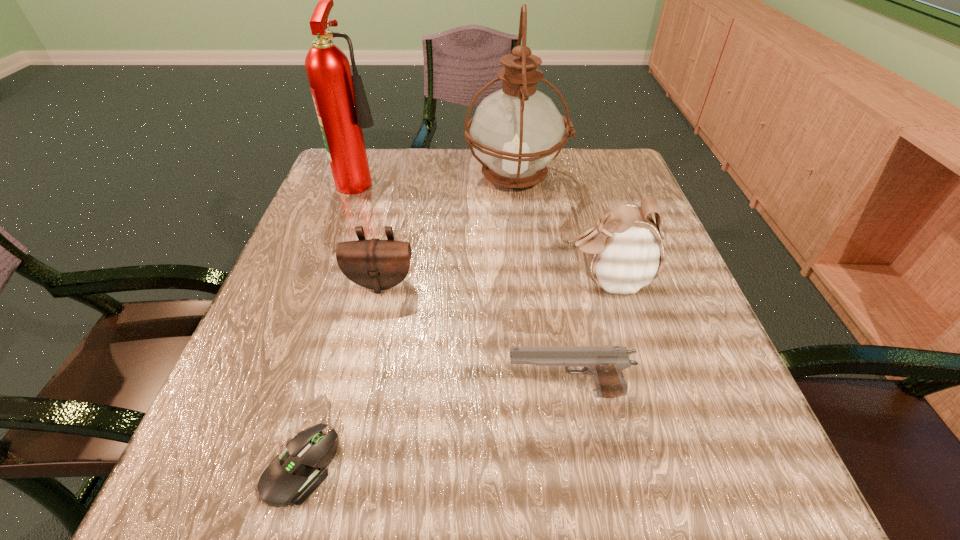
Locate an element on the screen. The image size is (960, 540). oil lamp is located at coordinates (517, 131).

Find the location of a particular element. The image size is (960, 540). fire extinguisher is located at coordinates (340, 100).

Where is `the right pouch`? the right pouch is located at coordinates (625, 251).

The image size is (960, 540). I want to click on the taller pouch, so click(625, 251).

I want to click on the second nearest object, so click(x=605, y=364).

Image resolution: width=960 pixels, height=540 pixels. Find the location of `the shorter pouch`. the shorter pouch is located at coordinates (376, 264).

This screenshot has height=540, width=960. In order to click on the shortest object in this screenshot , I will do `click(292, 477)`.

The width and height of the screenshot is (960, 540). Find the location of `the nearest object`. the nearest object is located at coordinates (292, 477).

The width and height of the screenshot is (960, 540). Find the location of `vacant region located 0.070m on the left of the oil lamp`. vacant region located 0.070m on the left of the oil lamp is located at coordinates (437, 177).

You are a GUI agent. You are given a task and a screenshot of the screen. Output one action in this format:
    pyautogui.click(x=<x>, y=<y>)
    Task: Click on the free space located 0.210m at the nozzle of the fire extinguisher
    
    Given the screenshot: What is the action you would take?
    pyautogui.click(x=475, y=179)